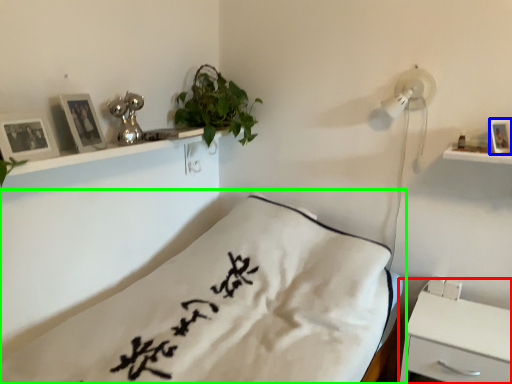
Question: Considering the real-world distances, which object is farthest from nightstand (highlighted by a red box)? picture frame (highlighted by a blue box) or bed (highlighted by a green box)?

Choices:
 (A) picture frame
 (B) bed

Answer: (A)